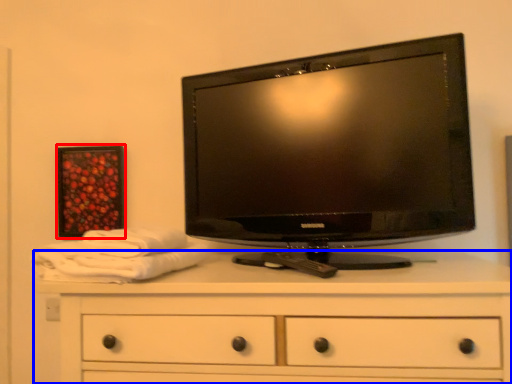
Question: Which object appears closest to the camera in this image, picture frame (highlighted by a red box) or chest of drawers (highlighted by a blue box)?

Choices:
 (A) picture frame
 (B) chest of drawers

Answer: (B)